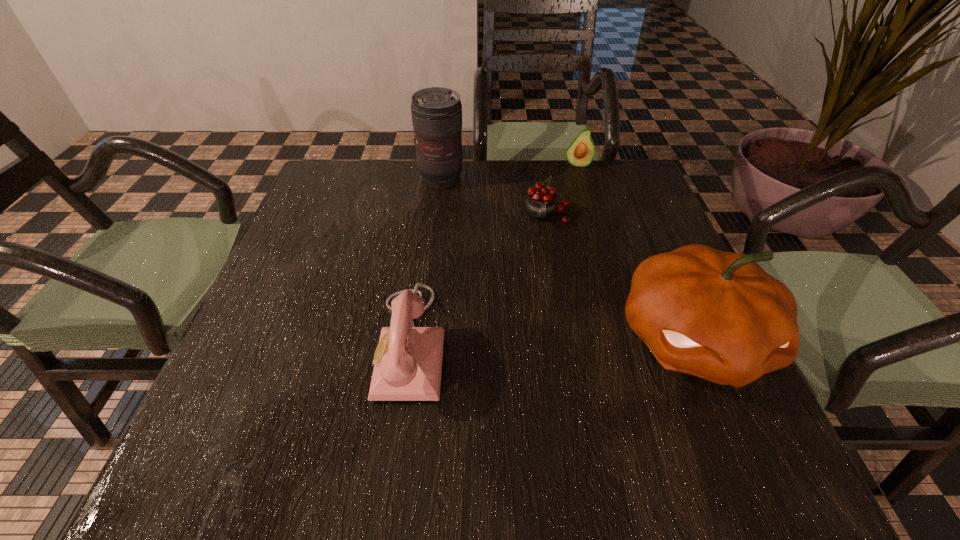
Find the location of a particular element. This screenshot has height=540, width=960. the third tallest object is located at coordinates (408, 364).

The height and width of the screenshot is (540, 960). Identify the location of pumpkin. (717, 315).

The width and height of the screenshot is (960, 540). I want to click on the third object from left to right, so click(540, 204).

Find the location of `the third farthest object`. the third farthest object is located at coordinates (540, 204).

Where is `avocado`? avocado is located at coordinates (580, 153).

Locate an element on the screen. This screenshot has height=540, width=960. telephoto lens is located at coordinates (436, 112).

The width and height of the screenshot is (960, 540). I want to click on free space located on the dial of the telephone, so click(274, 343).

You are a GUI agent. You are given a task and a screenshot of the screen. Output one action in this format:
    pyautogui.click(x=<x>, y=<y>)
    Task: Click on the free space located 0.080m on the dial of the telephone
    The height and width of the screenshot is (540, 960).
    Given the screenshot: What is the action you would take?
    pyautogui.click(x=336, y=343)

This screenshot has height=540, width=960. In order to click on vacant space located 0.190m on the dial of the telephone in this screenshot , I will do `click(278, 343)`.

The image size is (960, 540). What are the coordinates of `vacant space located on the handle side of the third object from right to left` in the screenshot? It's located at (555, 296).